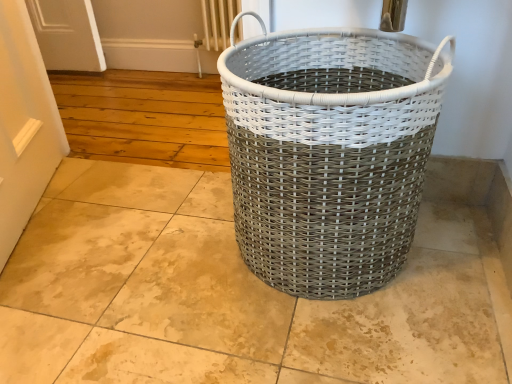
The image size is (512, 384). I want to click on unoccupied region to the right of white woven basket at center, so click(454, 261).